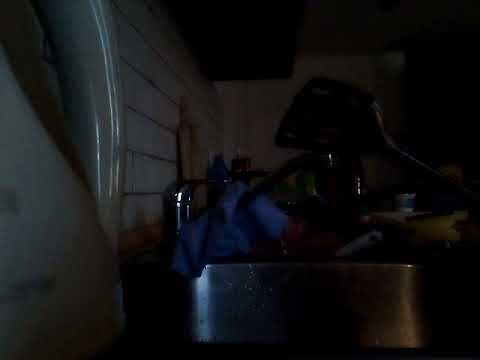
Image resolution: width=480 pixels, height=360 pixels. I want to click on faucet, so click(x=312, y=159).